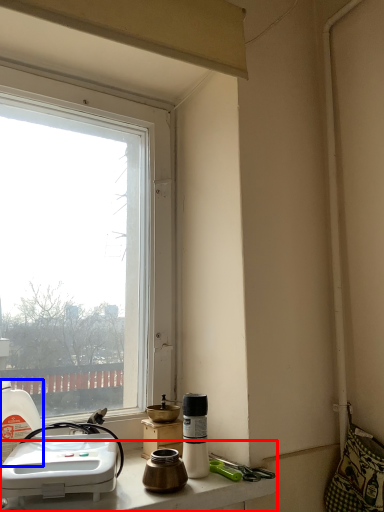
Question: Which of the following is the closest to the observer, counter top (highlighted by a red box) or bottle (highlighted by a blue box)?

Choices:
 (A) counter top
 (B) bottle

Answer: (A)